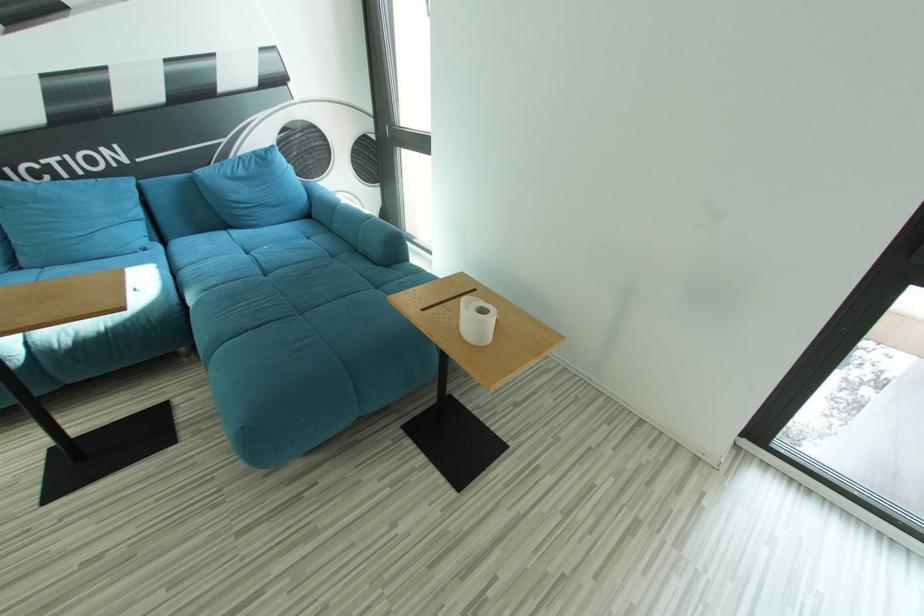
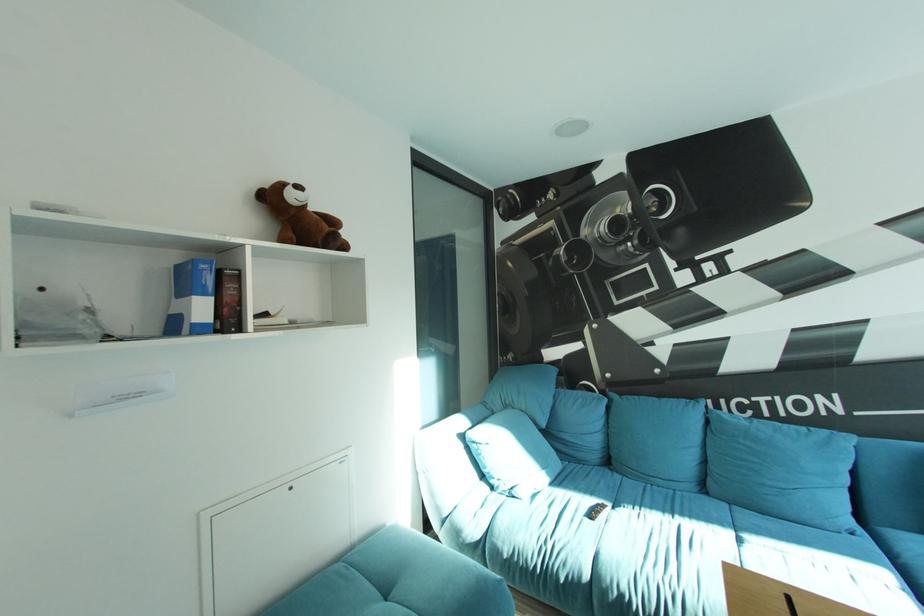
Question: The images are taken continuously from a first-person perspective. In which direction is your viewpoint rotating?

Choices:
 (A) Left
 (B) Right
 (C) Up
 (D) Down

Answer: (A)